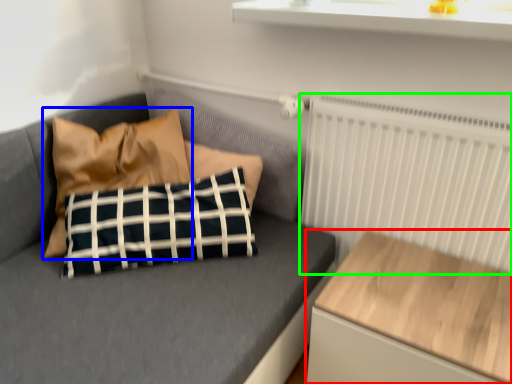
Question: Which object is the closest to the table (highlighted by a red box)? Choose among these: pillow (highlighted by a blue box) or radiator (highlighted by a green box).

Choices:
 (A) pillow
 (B) radiator

Answer: (B)